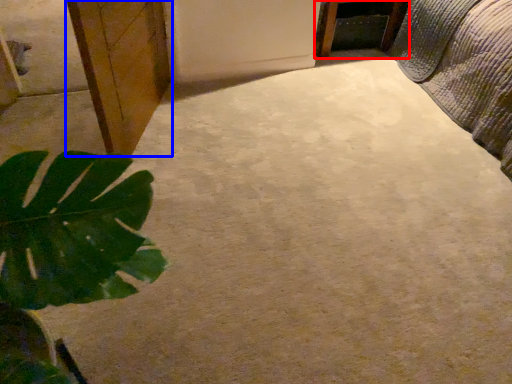
Question: Which of the following is the farthest to the observer, furniture (highlighted by a red box) or cabinetry (highlighted by a blue box)?

Choices:
 (A) furniture
 (B) cabinetry

Answer: (A)